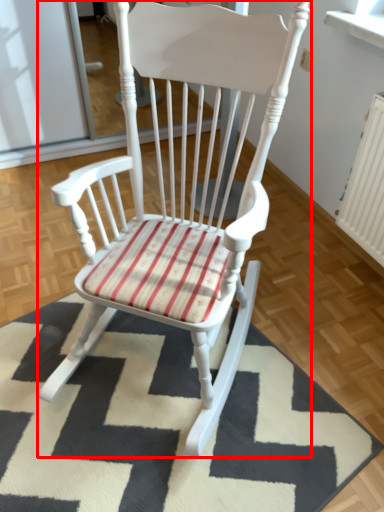
Question: In this image, where is chair (annotated by the red box) located relative to mat?

Choices:
 (A) right
 (B) left

Answer: (A)